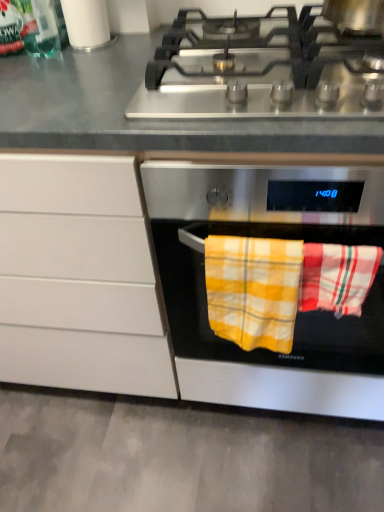
In order to click on vacant space in front of white paper towel at upper left in this screenshot , I will do `click(83, 66)`.